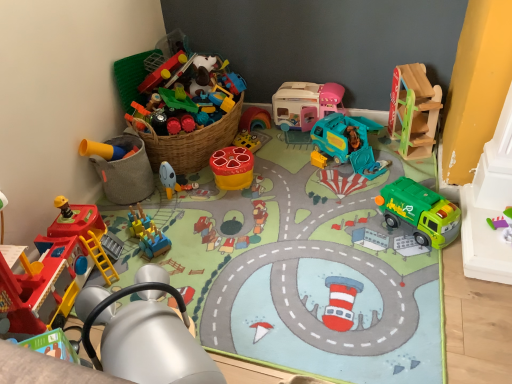
Where is `free space between matte plastic stool at center, the 5th toy from the right, and matte plastic toy at center, which is the 3th toy in left-to-right order`? Image resolution: width=512 pixels, height=384 pixels. free space between matte plastic stool at center, the 5th toy from the right, and matte plastic toy at center, which is the 3th toy in left-to-right order is located at coordinates (205, 185).